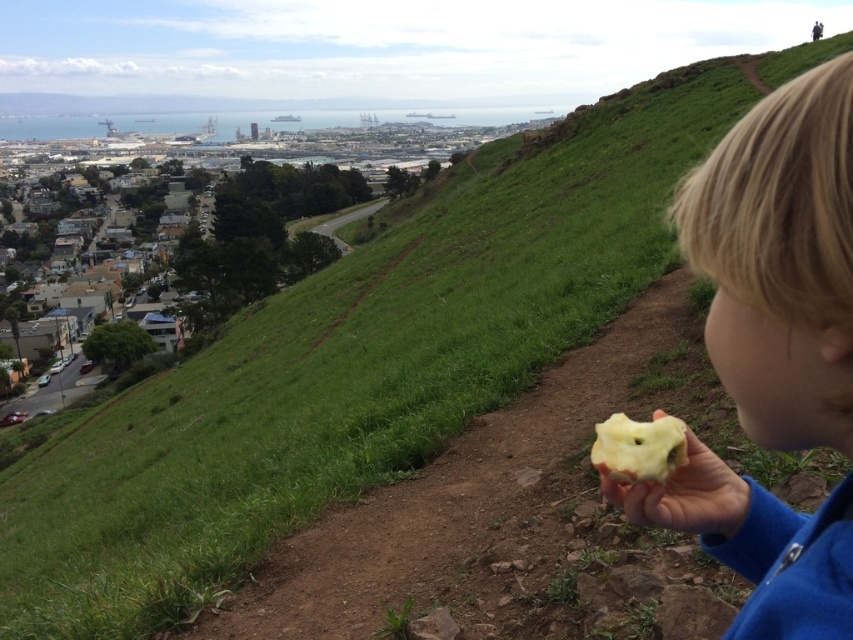
Between yellow matte apple at right and yellow matte apple at lower right, which one has more height?

With more height is yellow matte apple at right.

Does point (743, 518) come closer to viewer compared to point (604, 456)?

That is False.

Does point (735, 531) lie in front of point (622, 467)?

No, it is behind (622, 467).

Where is `yellow matte apple at right`? yellow matte apple at right is located at coordinates (685, 496).

From the picture: Does blonde hair at upper right lie in front of yellow matte apple at lower right?

Yes, blonde hair at upper right is in front of yellow matte apple at lower right.

Which is below, blonde hair at upper right or yellow matte apple at lower right?

yellow matte apple at lower right is lower down.

The image size is (853, 640). Describe the element at coordinates (780, 260) in the screenshot. I see `blonde hair at upper right` at that location.

Find the location of a particular element. The width and height of the screenshot is (853, 640). blonde hair at upper right is located at coordinates (780, 260).

In the scene shown: Which is more to the left, blonde hair at upper right or yellow matte apple at right?

yellow matte apple at right

How distant is blonde hair at upper right from yellow matte apple at right?

3.18 inches

Does point (824, 342) come behind point (700, 506)?

No, it is in front of (700, 506).

Image resolution: width=853 pixels, height=640 pixels. I want to click on blonde hair at upper right, so click(780, 260).